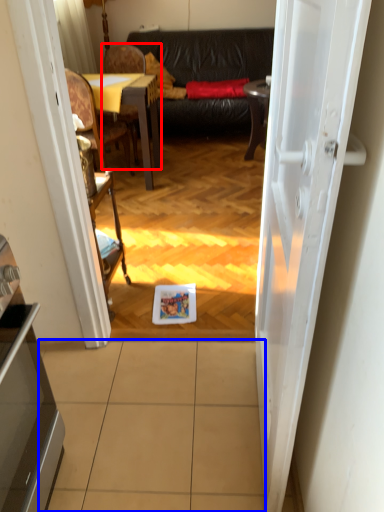
Question: Among these objects, which one is farthest to the camera, chair (highlighted by a red box) or tile (highlighted by a blue box)?

Choices:
 (A) chair
 (B) tile

Answer: (A)